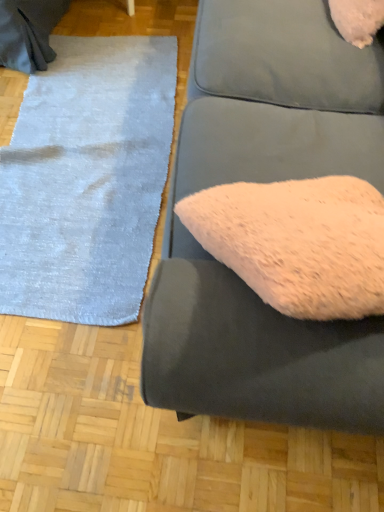
The image size is (384, 512). Identify the location of vacant region below light blue plush rug at left (from a real-world perspective). (90, 188).